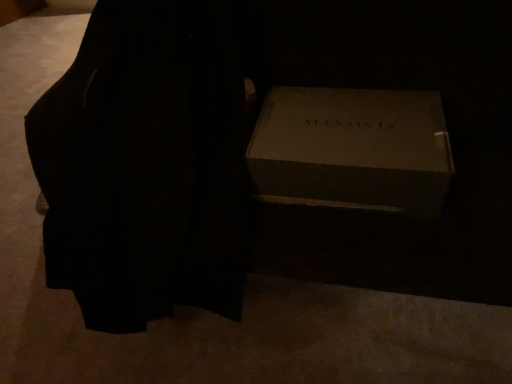
Question: Is black velvet dress at center to the left or to the right of matte cardboard box at center in the image?

Choices:
 (A) right
 (B) left

Answer: (B)

Question: Considering the positions of point (174, 180) and point (364, 94), is point (174, 180) closer or farther from the camera than point (364, 94)?

Choices:
 (A) farther
 (B) closer

Answer: (B)

Question: In terms of height, does black velvet dress at center look taller or shorter compared to matte cardboard box at center?

Choices:
 (A) short
 (B) tall

Answer: (B)

Question: Is matte cardboard box at center taller or shorter than black velvet dress at center?

Choices:
 (A) tall
 (B) short

Answer: (B)

Question: From a real-world perspective, is matte cardboard box at center physically located above or below black velvet dress at center?

Choices:
 (A) above
 (B) below

Answer: (A)

Question: Relative to black velvet dress at center, is matte cardboard box at center in front or behind?

Choices:
 (A) behind
 (B) front

Answer: (A)

Question: From the image's perspective, is matte cardboard box at center located above or below black velvet dress at center?

Choices:
 (A) above
 (B) below

Answer: (B)